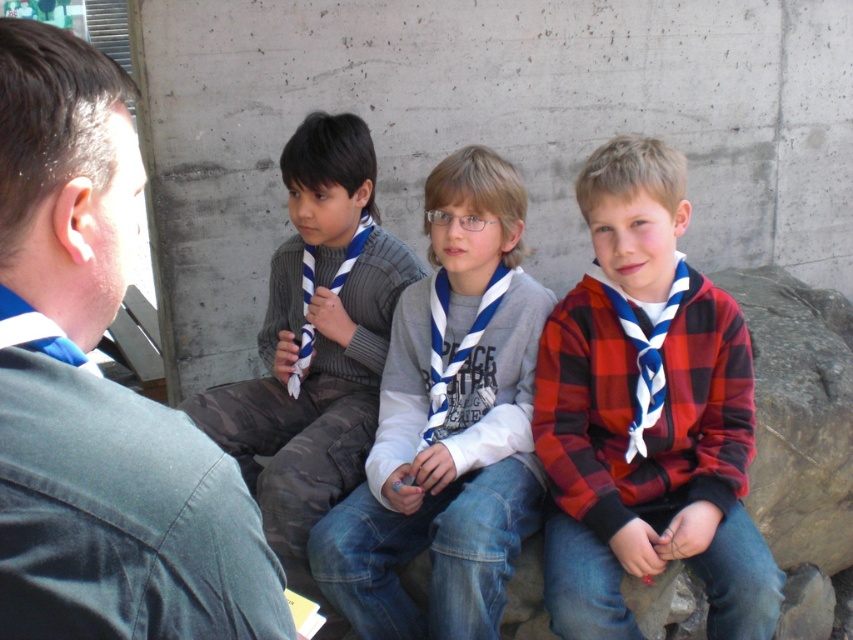
Question: In this image, where is white cotton scarf at center located relative to white striped necktie at center?

Choices:
 (A) left
 (B) right

Answer: (A)

Question: Which point is closer to the camera taking this photo?

Choices:
 (A) (466, 332)
 (B) (292, 371)
 (C) (35, 200)

Answer: (C)

Question: Which point is farther to the camera?

Choices:
 (A) (45, 221)
 (B) (328, 232)
 (C) (311, 348)

Answer: (C)

Question: Is red plaid shirt at center to the right of white striped necktie at center from the viewer's perspective?

Choices:
 (A) no
 (B) yes

Answer: (B)

Question: Which of the following is the closest to the observer?

Choices:
 (A) white cotton scarf at center
 (B) gray rough rock at right

Answer: (A)

Question: Can you confirm if white cotton scarf at center is wider than white striped tie at center?

Choices:
 (A) no
 (B) yes

Answer: (B)